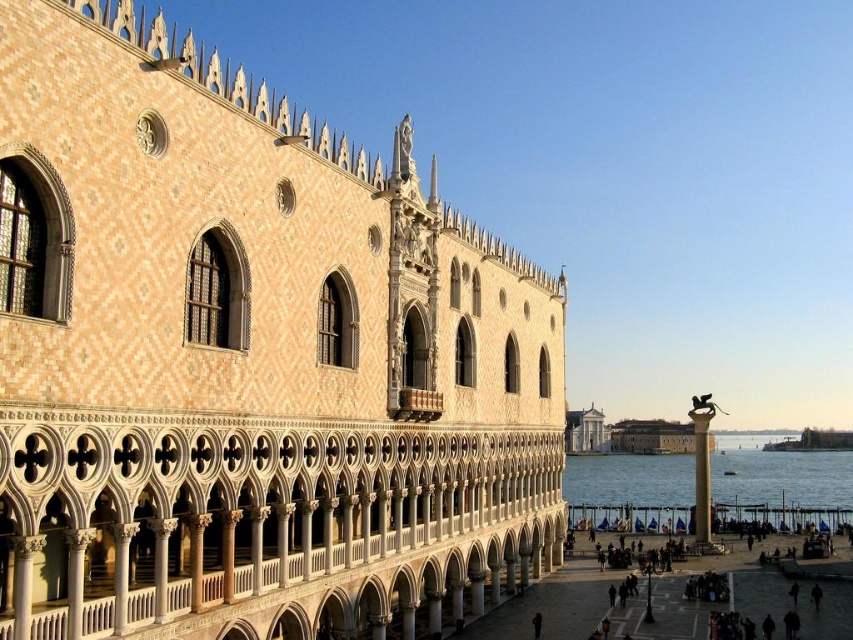
You are an architect analyzing the proportions of the beige mosaic palace at left and the clear blue water at lower right in the image. Which object appears narrower in the scene?

The beige mosaic palace at left is thinner than clear blue water at lower right, so the beige mosaic palace at left appears narrower in the scene.

You are standing in front of the grand building and notice two points marked on its facade. The first point is at coordinate point (12, 605) and the second at point (697, 428). Which of these points is positioned closer to your viewpoint?

Point (12, 605) is closer to the viewer than point (697, 428).

You are standing on a path in front of the beige mosaic palace at left and want to reach the clear blue water at lower right. Based on the scene description, which direction should you move to get closer to the water?

You should move towards the lower right direction to get closer to the clear blue water at lower right since the beige mosaic palace at left is located above it.